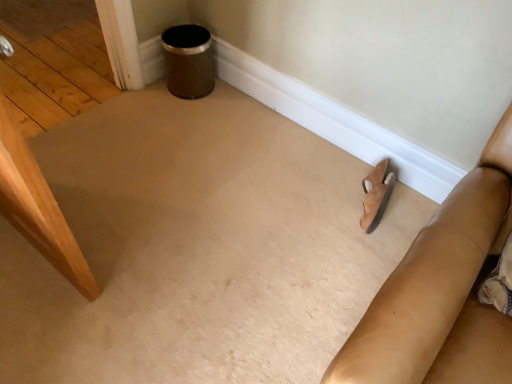
The height and width of the screenshot is (384, 512). What do you see at coordinates (376, 195) in the screenshot? I see `suede sandal at lower right` at bounding box center [376, 195].

You are a GUI agent. You are given a task and a screenshot of the screen. Output one action in this format:
    pyautogui.click(x=<x>, y=<y>)
    Task: Click on the suede sandal at lower right
    Image resolution: width=512 pixels, height=384 pixels.
    Given the screenshot: What is the action you would take?
    pyautogui.click(x=376, y=195)

Where is `suede-like tan couch at lower right`? Image resolution: width=512 pixels, height=384 pixels. suede-like tan couch at lower right is located at coordinates (442, 291).

Image resolution: width=512 pixels, height=384 pixels. Describe the element at coordinates (442, 291) in the screenshot. I see `suede-like tan couch at lower right` at that location.

The height and width of the screenshot is (384, 512). What are the coordinates of `suede sandal at lower right` in the screenshot? It's located at tap(376, 195).

Considering the relative positions of suede sandal at lower right and suede-like tan couch at lower right in the image provided, is suede sandal at lower right to the left of suede-like tan couch at lower right from the viewer's perspective?

Indeed, suede sandal at lower right is positioned on the left side of suede-like tan couch at lower right.

Is the depth of suede sandal at lower right greater than that of suede-like tan couch at lower right?

Yes.

Is point (380, 190) behind point (495, 335)?

Yes.

From the image's perspective, is suede sandal at lower right positioned above or below suede-like tan couch at lower right?

suede sandal at lower right is above suede-like tan couch at lower right.

Consider the image. From a real-world perspective, is suede sandal at lower right beneath suede-like tan couch at lower right?

Correct, in the physical world, suede sandal at lower right is lower than suede-like tan couch at lower right.

Considering the relative sizes of suede sandal at lower right and suede-like tan couch at lower right in the image provided, is suede sandal at lower right thinner than suede-like tan couch at lower right?

Yes, suede sandal at lower right is thinner than suede-like tan couch at lower right.

Based on the photo, is suede sandal at lower right taller or shorter than suede-like tan couch at lower right?

In the image, suede sandal at lower right appears to be shorter than suede-like tan couch at lower right.

Based on the photo, does suede sandal at lower right have a larger size compared to suede-like tan couch at lower right?

No.

Consider the image. Do you think suede sandal at lower right is within suede-like tan couch at lower right, or outside of it?

suede sandal at lower right is not inside suede-like tan couch at lower right, it's outside.

Is suede sandal at lower right directly adjacent to suede-like tan couch at lower right?

No, suede sandal at lower right is not touching suede-like tan couch at lower right.

Is suede-like tan couch at lower right at the back of suede sandal at lower right?

No, suede sandal at lower right's orientation is not away from suede-like tan couch at lower right.

Based on the photo, what's the angular difference between suede sandal at lower right and suede-like tan couch at lower right's facing directions?

They differ by 10.5 degrees in their facing directions.

Identify the location of footwear on the left of suede-like tan couch at lower right. [x=376, y=195].

Considering the relative positions of suede-like tan couch at lower right and suede sandal at lower right in the image provided, is suede-like tan couch at lower right to the right of suede sandal at lower right from the viewer's perspective?

Correct, you'll find suede-like tan couch at lower right to the right of suede sandal at lower right.

Which is behind, suede-like tan couch at lower right or suede sandal at lower right?

suede sandal at lower right is further from the camera.

Considering the positions of point (464, 249) and point (379, 164), is point (464, 249) closer or farther from the camera than point (379, 164)?

Point (464, 249) is positioned closer to the camera compared to point (379, 164).

From the image's perspective, is suede-like tan couch at lower right beneath suede sandal at lower right?

Correct, suede-like tan couch at lower right appears lower than suede sandal at lower right in the image.

From a real-world perspective, which object stands above the other?

suede-like tan couch at lower right.

In terms of width, does suede-like tan couch at lower right look wider or thinner when compared to suede sandal at lower right?

In the image, suede-like tan couch at lower right appears to be wider than suede sandal at lower right.

Looking at this image, between suede-like tan couch at lower right and suede sandal at lower right, which one has more height?

Standing taller between the two is suede-like tan couch at lower right.

Between suede-like tan couch at lower right and suede sandal at lower right, which one has smaller size?

suede sandal at lower right is smaller.

Choose the correct answer: Is suede-like tan couch at lower right inside suede sandal at lower right or outside it?

suede-like tan couch at lower right lies outside suede sandal at lower right.

Looking at this image, can you see suede-like tan couch at lower right touching suede sandal at lower right?

No, suede-like tan couch at lower right is not next to suede sandal at lower right.

Is suede-like tan couch at lower right aimed at suede sandal at lower right?

No, suede-like tan couch at lower right is not turned towards suede sandal at lower right.

Locate an element on the screen. This screenshot has width=512, height=384. furniture in front of the suede sandal at lower right is located at coordinates (442, 291).

Where is `footwear above the suede-like tan couch at lower right (from the image's perspective)`? Image resolution: width=512 pixels, height=384 pixels. footwear above the suede-like tan couch at lower right (from the image's perspective) is located at coordinates (376, 195).

Where is `footwear below the suede-like tan couch at lower right (from a real-world perspective)`? Image resolution: width=512 pixels, height=384 pixels. footwear below the suede-like tan couch at lower right (from a real-world perspective) is located at coordinates (376, 195).